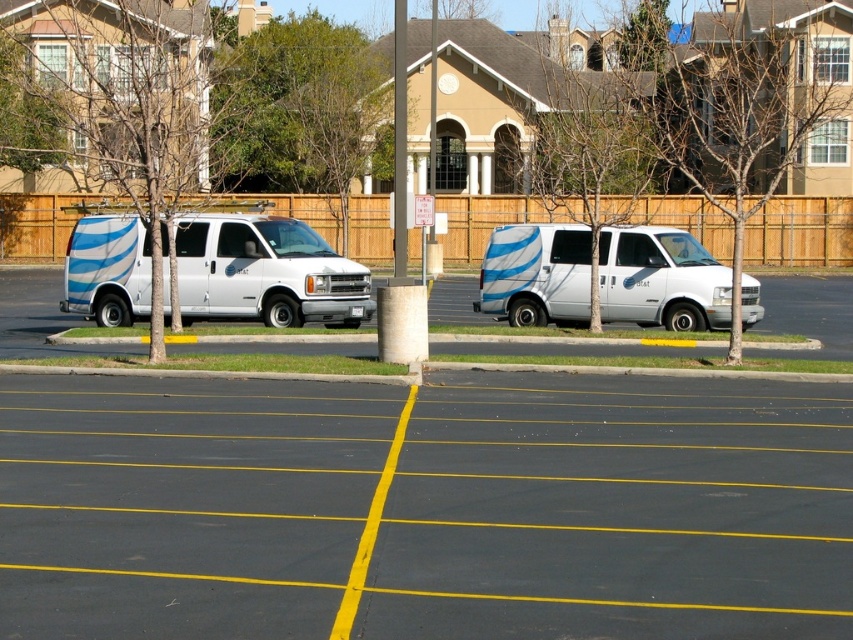
You are standing at the point marked as point (425, 508) in the parking lot. Which van, the white matte van at left or the other van, is directly in front of you?

The point (425, 508) corresponds to the white matte van at left, so the white matte van at left is directly in front of you.

You are standing at the point marked as point (425, 508) in the parking lot. Which vehicle are you closest to?

You are closest to the white matte van at left because the point (425, 508) corresponds to it.

What is the spatial relationship between the white matte van at left and the white glossy van at center?

The white matte van at left is positioned to the left of the white glossy van at center.